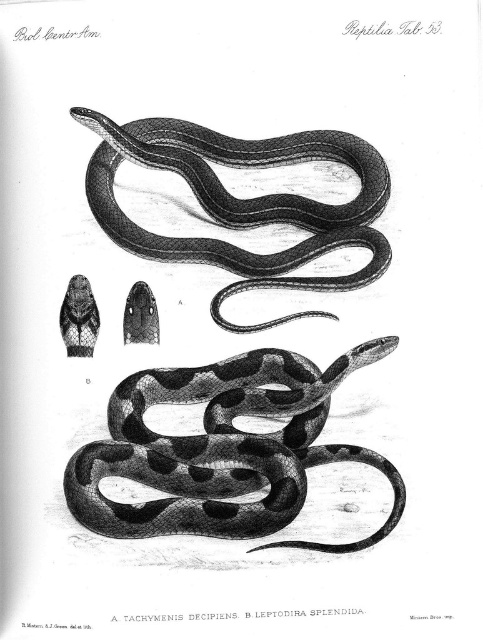
Is point (273, 380) more distant than point (181, 132)?

No, (273, 380) is closer to viewer.

Can you confirm if black textured snake at center is shorter than smooth black snake at center?

Yes, black textured snake at center is shorter than smooth black snake at center.

Is point (224, 401) behind point (266, 324)?

No, (224, 401) is in front of (266, 324).

Identify the location of black textured snake at center. This screenshot has width=483, height=640. (223, 449).